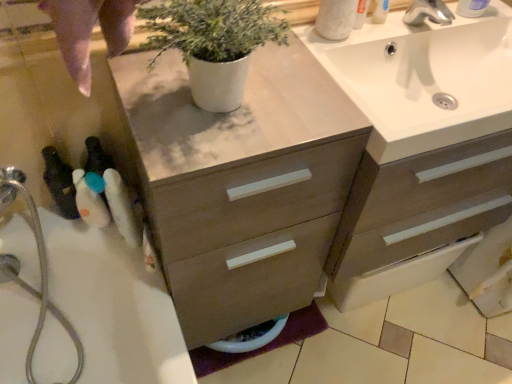
Question: From a real-world perspective, is white plastic bottle at lower left, which is the second toiletry from bottom to top, over white matte toilet paper at upper right?

Choices:
 (A) yes
 (B) no

Answer: (B)

Question: Does white plastic bottle at lower left, which is the second toiletry from bottom to top, appear on the right side of white matte toilet paper at upper right?

Choices:
 (A) yes
 (B) no

Answer: (B)

Question: Is white plastic bottle at lower left, arranged as the third toiletry when viewed from the top, outside white matte toilet paper at upper right?

Choices:
 (A) no
 (B) yes

Answer: (B)

Question: From a real-world perspective, is white plastic bottle at lower left, which is counted as the 2th toiletry, starting from the left, located beneath white matte toilet paper at upper right?

Choices:
 (A) no
 (B) yes

Answer: (B)

Question: Considering the relative sizes of white plastic bottle at lower left, which ranks as the third toiletry in right-to-left order, and white matte toilet paper at upper right in the image provided, is white plastic bottle at lower left, which ranks as the third toiletry in right-to-left order, shorter than white matte toilet paper at upper right?

Choices:
 (A) yes
 (B) no

Answer: (B)

Question: In the image, is white plastic soap dispenser at upper right, which appears as the 1th toiletry when viewed from the right, on the left side or the right side of white matte toilet paper at upper right?

Choices:
 (A) right
 (B) left

Answer: (A)

Question: From a real-world perspective, is white plastic soap dispenser at upper right, the fourth toiletry from the left, physically located above or below white matte toilet paper at upper right?

Choices:
 (A) above
 (B) below

Answer: (A)

Question: Which is correct: white plastic soap dispenser at upper right, the fourth toiletry from the left, is inside white matte toilet paper at upper right, or outside of it?

Choices:
 (A) inside
 (B) outside

Answer: (B)

Question: Looking at their shapes, would you say white plastic soap dispenser at upper right, which appears as the 1th toiletry when viewed from the right, is wider or thinner than white matte toilet paper at upper right?

Choices:
 (A) thin
 (B) wide

Answer: (B)

Question: From a real-world perspective, is white plastic bottle at lower left, arranged as the third toiletry when viewed from the top, positioned above or below white plastic soap dispenser at upper right, positioned as the 1th toiletry in top-to-bottom order?

Choices:
 (A) above
 (B) below

Answer: (B)

Question: Considering the positions of white plastic bottle at lower left, which ranks as the third toiletry in right-to-left order, and white plastic soap dispenser at upper right, the fourth toiletry when ordered from bottom to top, in the image, is white plastic bottle at lower left, which ranks as the third toiletry in right-to-left order, taller or shorter than white plastic soap dispenser at upper right, the fourth toiletry when ordered from bottom to top,?

Choices:
 (A) short
 (B) tall

Answer: (A)

Question: Considering the positions of white plastic bottle at lower left, which is counted as the 2th toiletry, starting from the left, and white plastic soap dispenser at upper right, the fourth toiletry when ordered from bottom to top, in the image, is white plastic bottle at lower left, which is counted as the 2th toiletry, starting from the left, wider or thinner than white plastic soap dispenser at upper right, the fourth toiletry when ordered from bottom to top,?

Choices:
 (A) thin
 (B) wide

Answer: (A)

Question: Does point (102, 203) appear closer or farther from the camera than point (468, 6)?

Choices:
 (A) farther
 (B) closer

Answer: (B)

Question: From a real-world perspective, is silver metallic faucet at upper right positioned above or below white plastic soap dispenser at upper right, which appears as the 1th toiletry when viewed from the right?

Choices:
 (A) above
 (B) below

Answer: (B)

Question: Considering the positions of silver metallic faucet at upper right and white plastic soap dispenser at upper right, the fourth toiletry when ordered from bottom to top, in the image, is silver metallic faucet at upper right bigger or smaller than white plastic soap dispenser at upper right, the fourth toiletry when ordered from bottom to top,?

Choices:
 (A) small
 (B) big

Answer: (A)